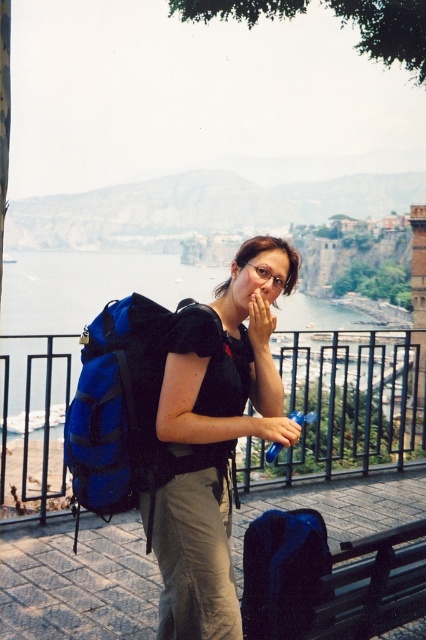
You are standing at the viewpoint and want to reach the point marked at coordinates (x=408, y=401). The metal railing is between you and the scenic view. Can you safely step over the railing to reach that point?

The point marked at coordinates (x=408, y=401) is 111.14 meters away from you. Since the metal railing is between you and the scenic view, stepping over it would not be safe due to the distance and potential hazards beyond the railing.

You are a hiker who wants to know if your black matte backpack at center can fit into the space between the blue fabric water at center and the railing. Can it fit?

The black matte backpack at center is thinner than the blue fabric water at center, so it can fit into the space between them.